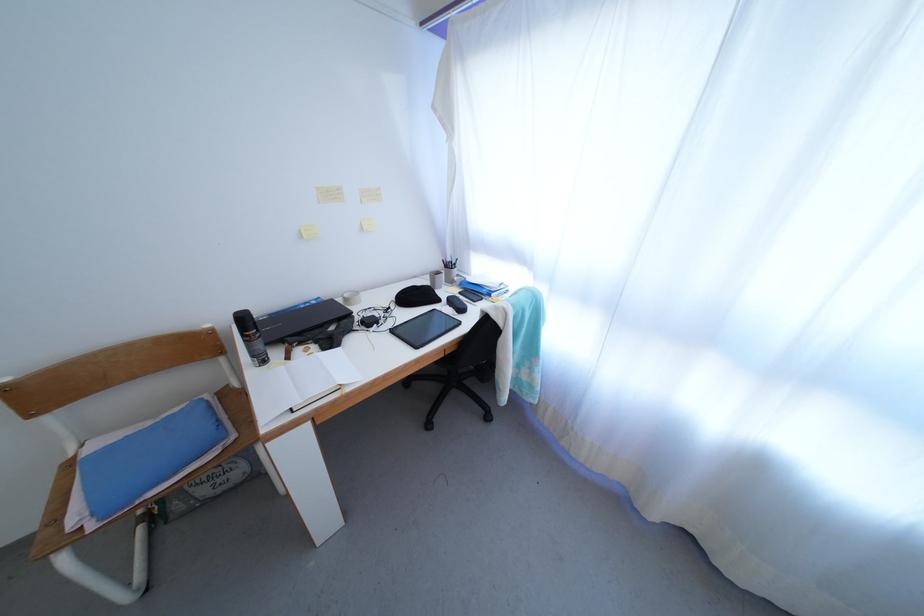
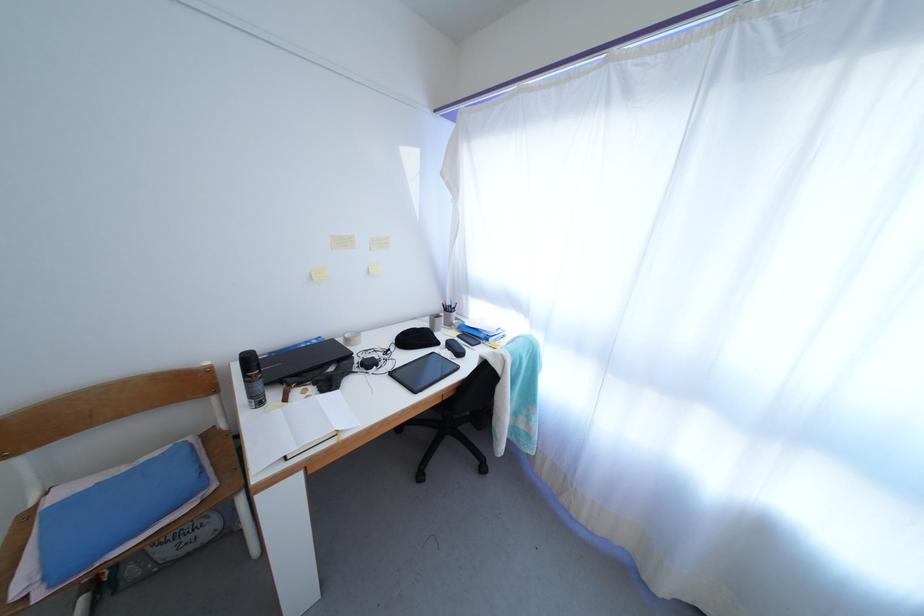
Find the pixel in the second image that matches point 154,430 in the first image.

(129, 475)